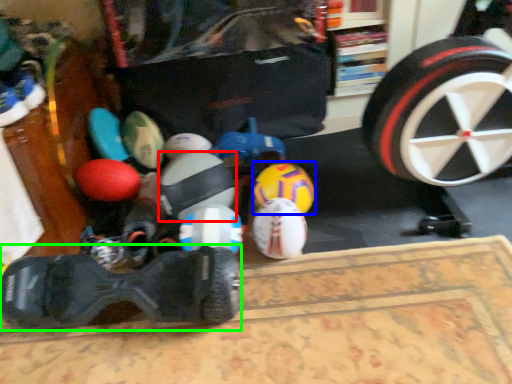
Question: Which is farther away from toy (highlighted by a red box)? toy (highlighted by a blue box) or footwear (highlighted by a green box)?

Choices:
 (A) toy
 (B) footwear

Answer: (B)